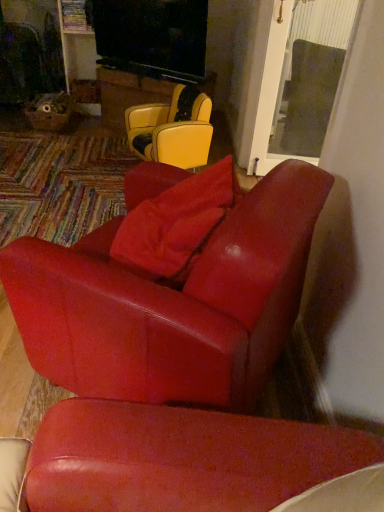
Find the location of a particular element. The width and height of the screenshot is (384, 512). matte red leather chair at center, acting as the 1th chair starting from the bottom is located at coordinates (172, 304).

At what (x,y) coordinates should I click in order to perform the action: click on leather yellow chair at center, the 2th chair positioned from the bottom. Please return your answer as a coordinate pair (x, y). The width and height of the screenshot is (384, 512). Looking at the image, I should click on (172, 131).

This screenshot has width=384, height=512. I want to click on transparent glass door at upper right, so click(300, 80).

Which object is closer to the camera taking this photo, matte red leather chair at center, which appears as the 1th chair when viewed from the front, or transparent glass door at upper right?

matte red leather chair at center, which appears as the 1th chair when viewed from the front.

How far apart are matte red leather chair at center, acting as the 1th chair starting from the bottom, and transparent glass door at upper right?

matte red leather chair at center, acting as the 1th chair starting from the bottom, and transparent glass door at upper right are 2.03 meters apart.

Identify the location of the 2nd chair positioned below the transparent glass door at upper right (from the image's perspective). This screenshot has width=384, height=512. (172, 304).

Is matte red leather chair at center, which appears as the 1th chair when viewed from the front, positioned with its back to transparent glass door at upper right?

No, matte red leather chair at center, which appears as the 1th chair when viewed from the front, is not facing away from transparent glass door at upper right.

Which is in front, leather yellow chair at center, arranged as the second chair when viewed from the front, or matte red leather chair at center, which ranks as the 2th chair in top-to-bottom order?

Positioned in front is matte red leather chair at center, which ranks as the 2th chair in top-to-bottom order.

Based on the photo, considering the sizes of leather yellow chair at center, arranged as the second chair when viewed from the front, and matte red leather chair at center, which is the 2th chair from back to front, in the image, is leather yellow chair at center, arranged as the second chair when viewed from the front, bigger or smaller than matte red leather chair at center, which is the 2th chair from back to front,?

Clearly, leather yellow chair at center, arranged as the second chair when viewed from the front, is smaller in size than matte red leather chair at center, which is the 2th chair from back to front.

Consider the image. Is leather yellow chair at center, the first chair positioned from the top, directly adjacent to matte red leather chair at center, which is the 2th chair from back to front?

There is a gap between leather yellow chair at center, the first chair positioned from the top, and matte red leather chair at center, which is the 2th chair from back to front.

Would you say matte red leather chair at center, which is the 2th chair from back to front, is part of leather yellow chair at center, arranged as the second chair when viewed from the front,'s contents?

Definitely not — matte red leather chair at center, which is the 2th chair from back to front, is not inside leather yellow chair at center, arranged as the second chair when viewed from the front.

From the picture: From a real-world perspective, which is physically above, matte red leather chair at center, which is the 2th chair from back to front, or leather yellow chair at center, the first chair positioned from the top?

matte red leather chair at center, which is the 2th chair from back to front, is physically above.

Does matte red leather chair at center, which ranks as the 2th chair in top-to-bottom order, have a smaller size compared to leather yellow chair at center, the first chair positioned from the top?

Incorrect, matte red leather chair at center, which ranks as the 2th chair in top-to-bottom order, is not smaller in size than leather yellow chair at center, the first chair positioned from the top.

Is matte red leather chair at center, which appears as the 1th chair when viewed from the front, beside leather yellow chair at center, arranged as the second chair when viewed from the front?

No, matte red leather chair at center, which appears as the 1th chair when viewed from the front, is not with leather yellow chair at center, arranged as the second chair when viewed from the front.

Between leather yellow chair at center, arranged as the second chair when viewed from the front, and transparent glass door at upper right, which one has less height?

Standing shorter between the two is leather yellow chair at center, arranged as the second chair when viewed from the front.

Are leather yellow chair at center, the first chair positioned from the top, and transparent glass door at upper right located far from each other?

They are positioned close to each other.

From a real-world perspective, is leather yellow chair at center, the first chair positioned from the top, above or below transparent glass door at upper right?

leather yellow chair at center, the first chair positioned from the top, is below transparent glass door at upper right.

How distant is leather yellow chair at center, the 2th chair positioned from the bottom, from transparent glass door at upper right?

leather yellow chair at center, the 2th chair positioned from the bottom, and transparent glass door at upper right are 24.65 inches apart.

Can you confirm if transparent glass door at upper right is smaller than satin red pillow at center?

Actually, transparent glass door at upper right might be larger than satin red pillow at center.

From a real-world perspective, is transparent glass door at upper right below satin red pillow at center?

Correct, in the physical world, transparent glass door at upper right is lower than satin red pillow at center.

In terms of width, does transparent glass door at upper right look wider or thinner when compared to satin red pillow at center?

Considering their sizes, transparent glass door at upper right looks broader than satin red pillow at center.

Consider the image. Is transparent glass door at upper right oriented towards satin red pillow at center?

No.

How much distance is there between satin red pillow at center and matte red leather chair at center, acting as the 1th chair starting from the bottom?

The distance of satin red pillow at center from matte red leather chair at center, acting as the 1th chair starting from the bottom, is 25.60 centimeters.

Looking at this image, between satin red pillow at center and matte red leather chair at center, which appears as the 1th chair when viewed from the front, which one has less height?

Standing shorter between the two is satin red pillow at center.

Is satin red pillow at center aimed at matte red leather chair at center, which appears as the 1th chair when viewed from the front?

Yes, satin red pillow at center is facing matte red leather chair at center, which appears as the 1th chair when viewed from the front.

From a real-world perspective, is satin red pillow at center below matte red leather chair at center, acting as the 1th chair starting from the bottom?

No, from a real-world perspective, satin red pillow at center is not under matte red leather chair at center, acting as the 1th chair starting from the bottom.

Locate an element on the screen. This screenshot has width=384, height=512. glass door lying behind the matte red leather chair at center, which appears as the 1th chair when viewed from the front is located at coordinates (300, 80).

Between transparent glass door at upper right and matte red leather chair at center, which appears as the 1th chair when viewed from the front, which one has less height?

matte red leather chair at center, which appears as the 1th chair when viewed from the front, is shorter.

Which point is more distant from viewer, (x=343, y=27) or (x=14, y=246)?

The point (x=343, y=27) is behind.

From the image's perspective, which object appears higher, transparent glass door at upper right or matte red leather chair at center, which appears as the 1th chair when viewed from the front?

transparent glass door at upper right appears higher in the image.

Identify the location of glass door above the matte red leather chair at center, which ranks as the 2th chair in top-to-bottom order (from the image's perspective). (300, 80).

Locate an element on the screen. chair above the leather yellow chair at center, which appears as the 1th chair when viewed from the back (from a real-world perspective) is located at coordinates (172, 304).

From the image, which object appears to be nearer to satin red pillow at center, leather yellow chair at center, which appears as the 1th chair when viewed from the back, or matte red leather chair at center, which is the 2th chair from back to front?

matte red leather chair at center, which is the 2th chair from back to front, is positioned closer to the anchor satin red pillow at center.

From the picture: Based on their spatial positions, is matte red leather chair at center, which ranks as the 2th chair in top-to-bottom order, or satin red pillow at center closer to transparent glass door at upper right?

satin red pillow at center is positioned closer to the anchor transparent glass door at upper right.

From the image, which object appears to be farther from satin red pillow at center, matte red leather chair at center, which ranks as the 2th chair in top-to-bottom order, or leather yellow chair at center, the first chair positioned from the top?

leather yellow chair at center, the first chair positioned from the top, lies further to satin red pillow at center than the other object.

Which object lies nearer to the anchor point leather yellow chair at center, the 2th chair positioned from the bottom, transparent glass door at upper right or satin red pillow at center?

transparent glass door at upper right is positioned closer to the anchor leather yellow chair at center, the 2th chair positioned from the bottom.

Which object lies further to the anchor point transparent glass door at upper right, matte red leather chair at center, which is the 2th chair from back to front, or leather yellow chair at center, the first chair positioned from the top?

matte red leather chair at center, which is the 2th chair from back to front, lies further to transparent glass door at upper right than the other object.

Looking at the image, which one is located further to transparent glass door at upper right, leather yellow chair at center, the first chair positioned from the top, or matte red leather chair at center, which ranks as the 2th chair in top-to-bottom order?

matte red leather chair at center, which ranks as the 2th chair in top-to-bottom order, is positioned further to the anchor transparent glass door at upper right.

When comparing their distances from satin red pillow at center, does leather yellow chair at center, arranged as the second chair when viewed from the front, or transparent glass door at upper right seem further?

transparent glass door at upper right lies further to satin red pillow at center than the other object.

Considering their positions, is leather yellow chair at center, the 2th chair positioned from the bottom, positioned further to matte red leather chair at center, acting as the 1th chair starting from the bottom, than satin red pillow at center?

The object further to matte red leather chair at center, acting as the 1th chair starting from the bottom, is leather yellow chair at center, the 2th chair positioned from the bottom.

This screenshot has height=512, width=384. Identify the location of pillow between matte red leather chair at center, which appears as the 1th chair when viewed from the front, and transparent glass door at upper right, along the z-axis. (175, 222).

At what (x,y) coordinates should I click in order to perform the action: click on chair between satin red pillow at center and transparent glass door at upper right from front to back. Please return your answer as a coordinate pair (x, y). The height and width of the screenshot is (512, 384). Looking at the image, I should click on (172, 131).

Where is `pillow between matte red leather chair at center, which is the 2th chair from back to front, and leather yellow chair at center, the first chair positioned from the top, in the front-back direction`? pillow between matte red leather chair at center, which is the 2th chair from back to front, and leather yellow chair at center, the first chair positioned from the top, in the front-back direction is located at coordinates (175, 222).

Find the location of a particular element. chair located between matte red leather chair at center, which ranks as the 2th chair in top-to-bottom order, and transparent glass door at upper right in the depth direction is located at coordinates (172, 131).